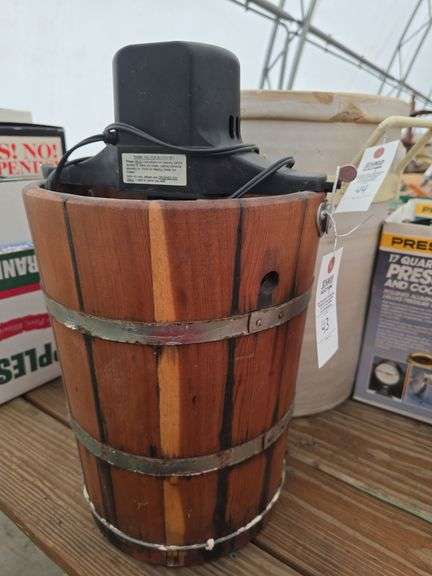
This screenshot has width=432, height=576. I want to click on pot, so click(308, 137).